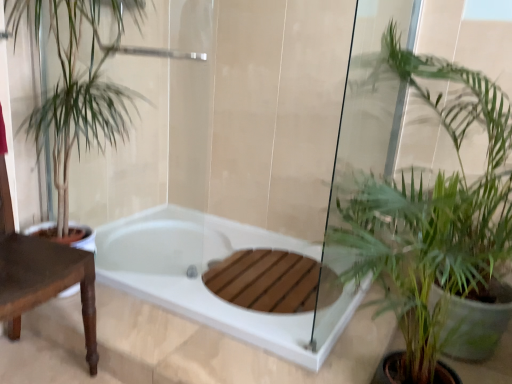
Question: Is green leafy plant at left, which appears as the second houseplant when viewed from the right, completely or partially inside green leafy plant at lower right, the 2th houseplant when ordered from left to right?

Choices:
 (A) no
 (B) yes

Answer: (A)

Question: Does green leafy plant at lower right, the 2th houseplant when ordered from left to right, lie behind green leafy plant at left, which appears as the second houseplant when viewed from the right?

Choices:
 (A) yes
 (B) no

Answer: (B)

Question: Can you confirm if green leafy plant at lower right, the 1th houseplant when ordered from right to left, is bigger than green leafy plant at left, which appears as the second houseplant when viewed from the right?

Choices:
 (A) yes
 (B) no

Answer: (A)

Question: Is green leafy plant at lower right, the 1th houseplant when ordered from right to left, oriented away from green leafy plant at left, which appears as the second houseplant when viewed from the right?

Choices:
 (A) yes
 (B) no

Answer: (B)

Question: Can you confirm if green leafy plant at lower right, the 2th houseplant when ordered from left to right, is shorter than green leafy plant at left, which appears as the second houseplant when viewed from the right?

Choices:
 (A) no
 (B) yes

Answer: (A)

Question: In terms of width, does brown wooden table at left look wider or thinner when compared to green leafy plant at lower right, the 1th houseplant when ordered from right to left?

Choices:
 (A) wide
 (B) thin

Answer: (B)

Question: Is brown wooden table at left taller or shorter than green leafy plant at lower right, the 1th houseplant when ordered from right to left?

Choices:
 (A) short
 (B) tall

Answer: (A)

Question: Based on their sizes in the image, would you say brown wooden table at left is bigger or smaller than green leafy plant at lower right, the 1th houseplant when ordered from right to left?

Choices:
 (A) big
 (B) small

Answer: (B)

Question: From a real-world perspective, is brown wooden table at left physically located above or below green leafy plant at lower right, the 2th houseplant when ordered from left to right?

Choices:
 (A) below
 (B) above

Answer: (A)

Question: From the image's perspective, relative to white glossy bathtub at center, is green leafy plant at left, which is counted as the first houseplant, starting from the left, above or below?

Choices:
 (A) above
 (B) below

Answer: (A)

Question: Is green leafy plant at left, which is counted as the first houseplant, starting from the left, in front of or behind white glossy bathtub at center in the image?

Choices:
 (A) behind
 (B) front

Answer: (B)

Question: Based on their sizes in the image, would you say green leafy plant at left, which is counted as the first houseplant, starting from the left, is bigger or smaller than white glossy bathtub at center?

Choices:
 (A) big
 (B) small

Answer: (A)

Question: From their relative heights in the image, would you say green leafy plant at left, which appears as the second houseplant when viewed from the right, is taller or shorter than white glossy bathtub at center?

Choices:
 (A) tall
 (B) short

Answer: (A)

Question: Is point (86, 82) closer or farther from the camera than point (493, 158)?

Choices:
 (A) closer
 (B) farther

Answer: (B)

Question: Is green leafy plant at left, which appears as the second houseplant when viewed from the right, to the left or to the right of green leafy plant at lower right, the 2th houseplant when ordered from left to right, in the image?

Choices:
 (A) left
 (B) right

Answer: (A)